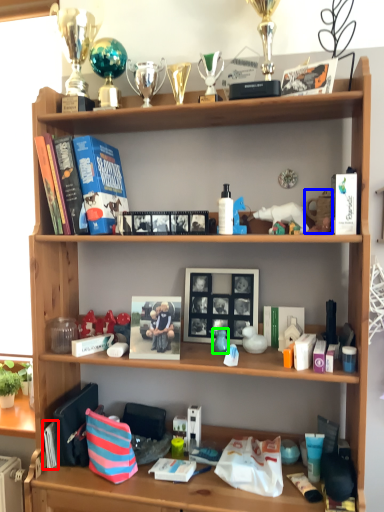
Question: Estimate the real-world distances between objects in this image. Which object is closer to book (highlighted by a red box), toy (highlighted by a blue box) or toy (highlighted by a green box)?

Choices:
 (A) toy
 (B) toy

Answer: (B)